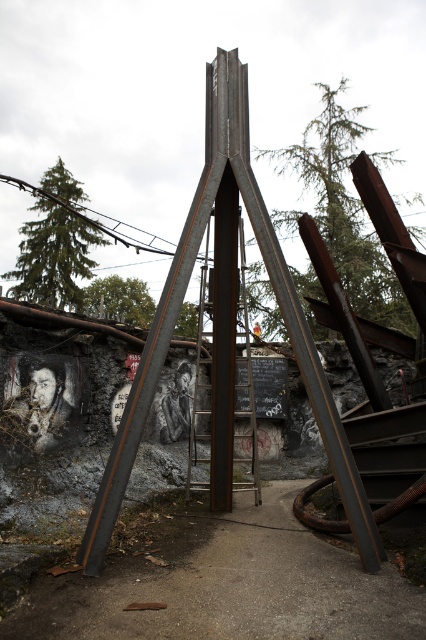
Can you confirm if concrete at center is taller than rusty metal ladder at center?

Indeed, concrete at center has a greater height compared to rusty metal ladder at center.

Who is more distant from viewer, (226, 611) or (203, 284)?

Positioned behind is point (203, 284).

Who is more distant from viewer, [207,584] or [204,296]?

The point [204,296] is more distant.

The width and height of the screenshot is (426, 640). Identify the location of concrete at center. (227, 584).